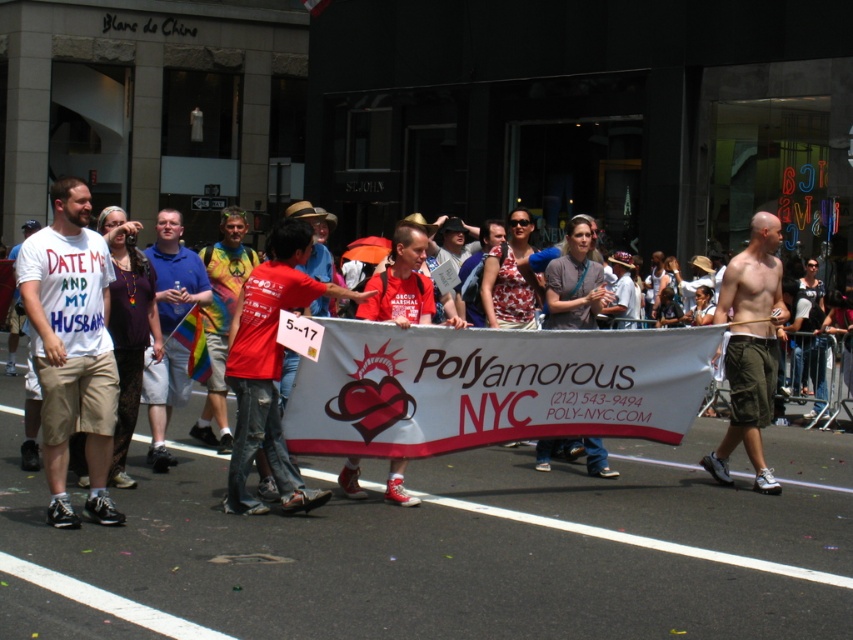
You are a photographer at the parade and want to take a photo of the red cotton shirt at center and the shiny khaki shorts at right. Which object is positioned closer to the camera?

The red cotton shirt at center is closer to the viewer than the shiny khaki shorts at right, so the red cotton shirt at center would be the one closer to the camera.